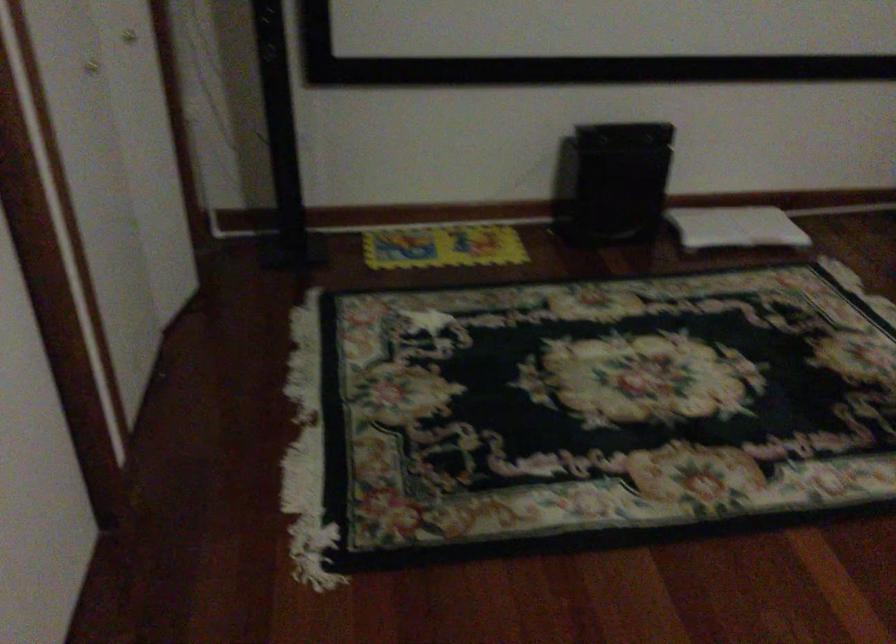
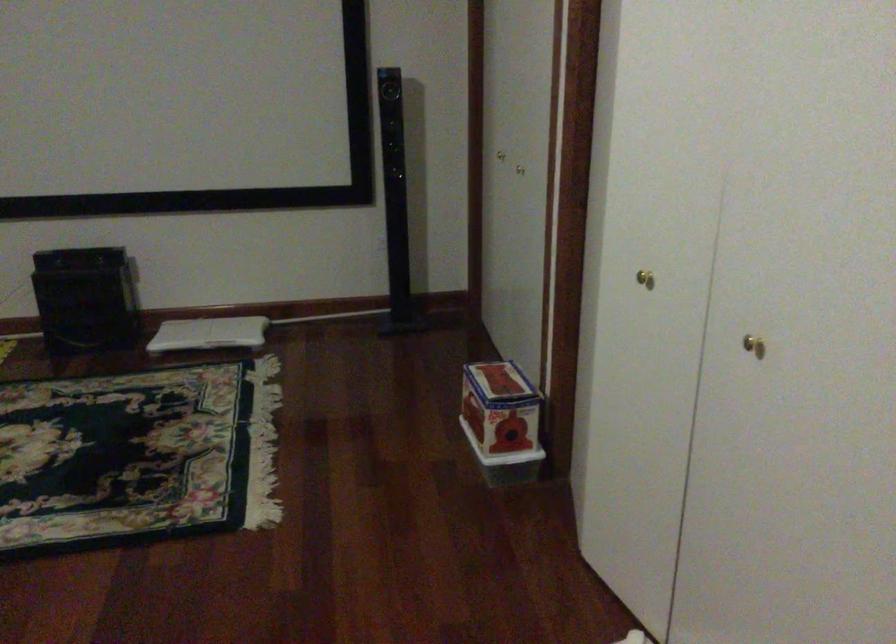
Where in the second image is the point corresponding to the point at 761,225 from the first image?

(209, 333)